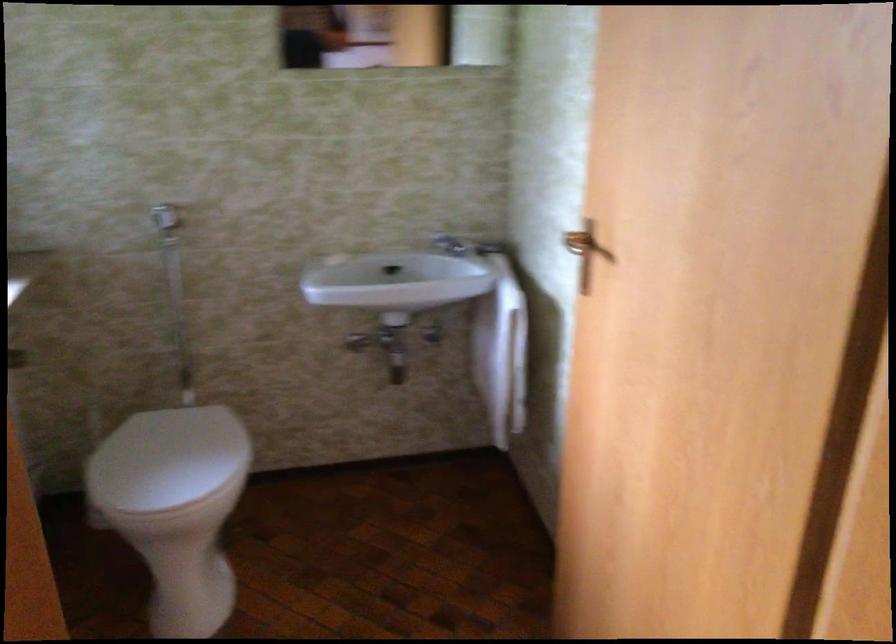
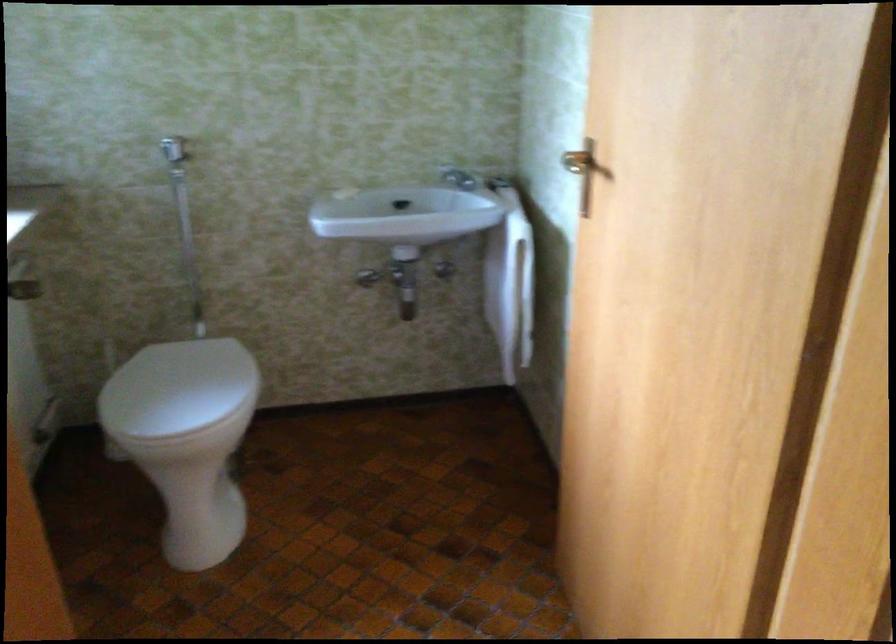
In the second image, find the point that corresponds to pixel 168 460 in the first image.

(177, 388)